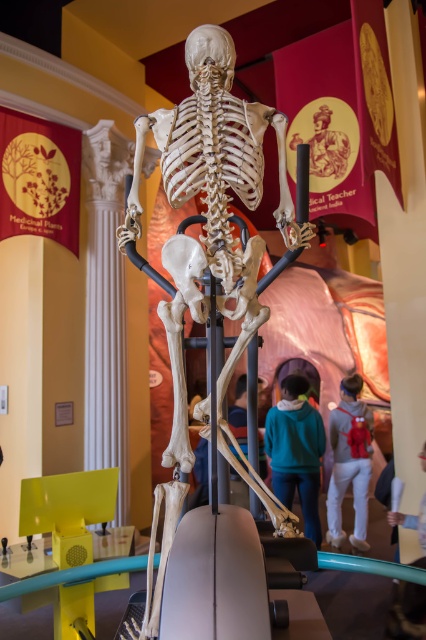
Is point (302, 243) closer to viewer compared to point (290, 497)?

That is True.

Is point (189, 170) positioned before point (276, 451)?

Yes, point (189, 170) is closer to viewer.

Locate an element on the screen. white bone skeleton at center is located at coordinates (213, 230).

Can you confirm if teal hoodie at center is shorter than gray hoodie at center?

Yes, teal hoodie at center is shorter than gray hoodie at center.

Who is lower down, teal hoodie at center or gray hoodie at center?

gray hoodie at center

Does point (316, 448) come closer to viewer compared to point (368, 417)?

That is True.

Where is `teal hoodie at center`? The image size is (426, 640). teal hoodie at center is located at coordinates [x=296, y=451].

Does white bone skeleton at center have a lesser width compared to gray hoodie at center?

In fact, white bone skeleton at center might be wider than gray hoodie at center.

Is white bone skeleton at center taller than gray hoodie at center?

Indeed, white bone skeleton at center has a greater height compared to gray hoodie at center.

Between point (233, 304) and point (363, 508), which one is positioned in front?

Positioned in front is point (233, 304).

The image size is (426, 640). In order to click on white bone skeleton at center in this screenshot , I will do `click(213, 230)`.